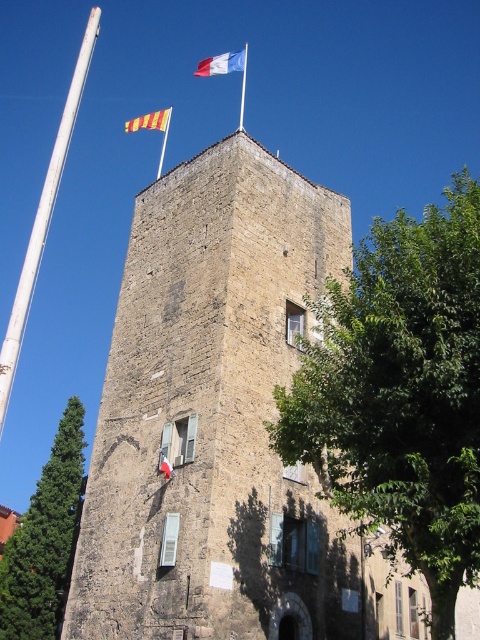
Question: In this image, where is green leafy tree at center located relative to white metallic pole at left?

Choices:
 (A) above
 (B) below

Answer: (B)

Question: Which object is the farthest from the brown stone tower at center?

Choices:
 (A) green leafy tree at left
 (B) white metallic pole at left
 (C) white flagpole at top

Answer: (C)

Question: Can you confirm if white fabric flag at top center is positioned to the right of white flagpole at top?

Choices:
 (A) no
 (B) yes

Answer: (A)

Question: Which object appears farthest from the camera in this image?

Choices:
 (A) white flagpole at top
 (B) white fabric flag at top center

Answer: (A)

Question: Among these objects, which one is nearest to the camera?

Choices:
 (A) green leafy tree at left
 (B) white fabric flag at top center
 (C) white flagpole at top

Answer: (A)

Question: Is green leafy tree at left wider than white flagpole at top?

Choices:
 (A) yes
 (B) no

Answer: (A)